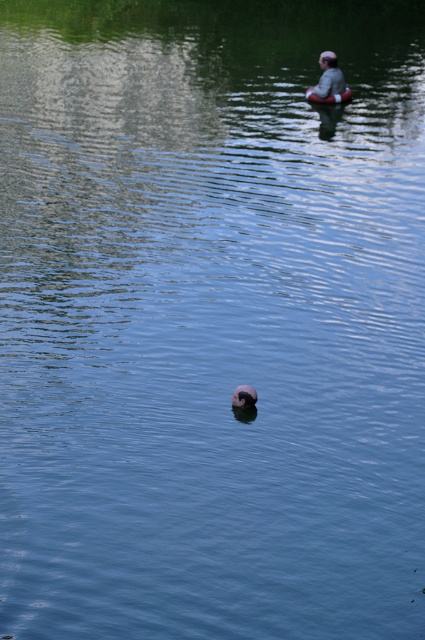
You are planning to store the smooth plastic canoe at upper center and the smooth pink rubber ring at upper center in a vertical storage rack. The rack has two shelves with a height difference of 30 cm between them. Which object should be placed on the higher shelf to ensure both fit without overlapping?

The smooth plastic canoe at upper center has a greater height compared to the smooth pink rubber ring at upper center, so it should be placed on the higher shelf to accommodate its height while the pink rubber ring can be placed on the lower shelf without overlapping.